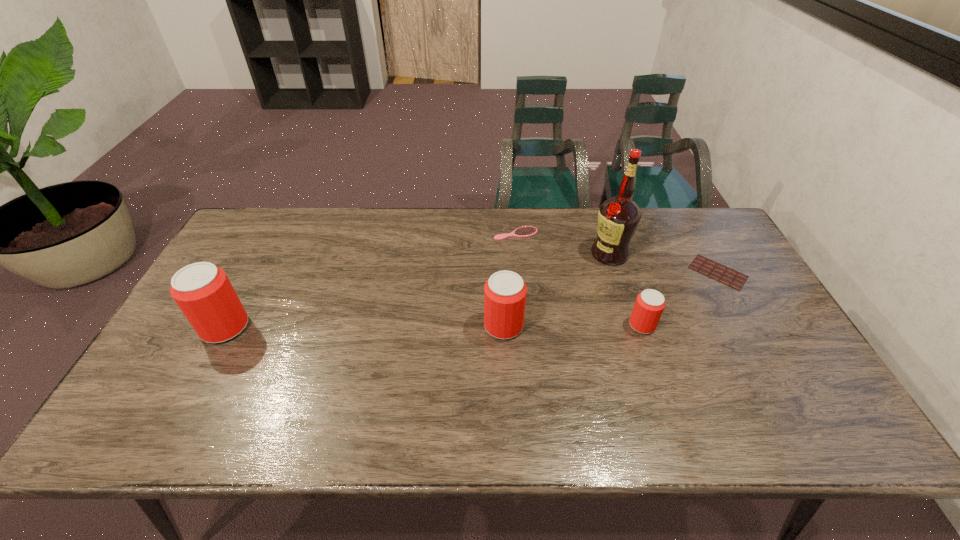
This screenshot has height=540, width=960. Find the location of `unoccupied position between the tallest object and the leftmost object`. unoccupied position between the tallest object and the leftmost object is located at coordinates (418, 291).

Identify the location of free space between the third tallest object and the rightmost object. This screenshot has width=960, height=540. (611, 299).

This screenshot has width=960, height=540. What are the coordinates of `free area in between the alcohol and the chocolate bar` in the screenshot? It's located at (663, 263).

This screenshot has width=960, height=540. I want to click on vacant space that is in between the leftmost beer can and the tallest object, so click(418, 291).

This screenshot has width=960, height=540. I want to click on object that ranks as the fourth closest to the hairbrush, so click(x=730, y=277).

Image resolution: width=960 pixels, height=540 pixels. I want to click on object that can be found as the third closest to the rightmost object, so [526, 231].

The height and width of the screenshot is (540, 960). What are the coordinates of `the second closest beer can relative to the leftmost object` in the screenshot? It's located at (649, 305).

Where is `beer can that stands as the closest to the chocolate bar`? beer can that stands as the closest to the chocolate bar is located at coordinates (649, 305).

Locate an element on the screen. Image resolution: width=960 pixels, height=540 pixels. vacant position in the image that satisfies the following two spatial constraints: 1. on the back side of the chocolate bar; 2. on the label of the alcohol is located at coordinates (708, 254).

Find the location of a particular element. free space that satisfies the following two spatial constraints: 1. on the back side of the shortest object; 2. on the label of the tallest object is located at coordinates (708, 254).